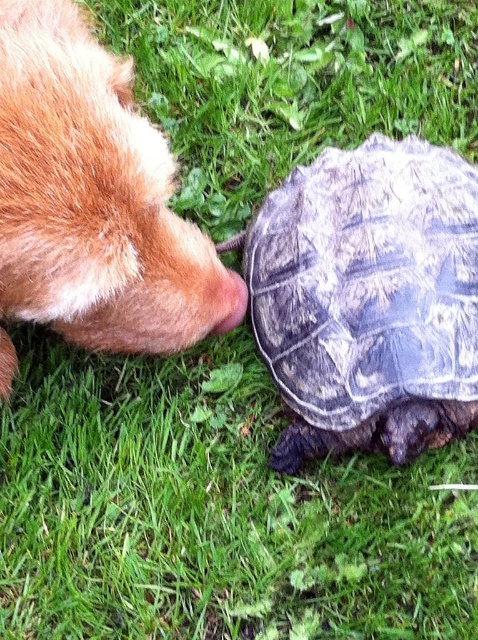
You are a photographer trying to capture a closeup of both the fuzzy fur nose at left and the brown fur nose at left in the scene. Which nose should you focus on first if you want to ensure both are in focus without moving the camera?

The fuzzy fur nose at left is wider than the brown fur nose at left, so focusing on the wider fuzzy fur nose at left first would help ensure both are in focus since it covers more area.

You are taking a photo of the scene and want to focus on both the dog and the turtle. The dog is at point [72,140] and the turtle is at point [218,326]. Which animal is closer to your camera lens?

The dog at point [72,140] is closer to the camera lens than the turtle at point [218,326].